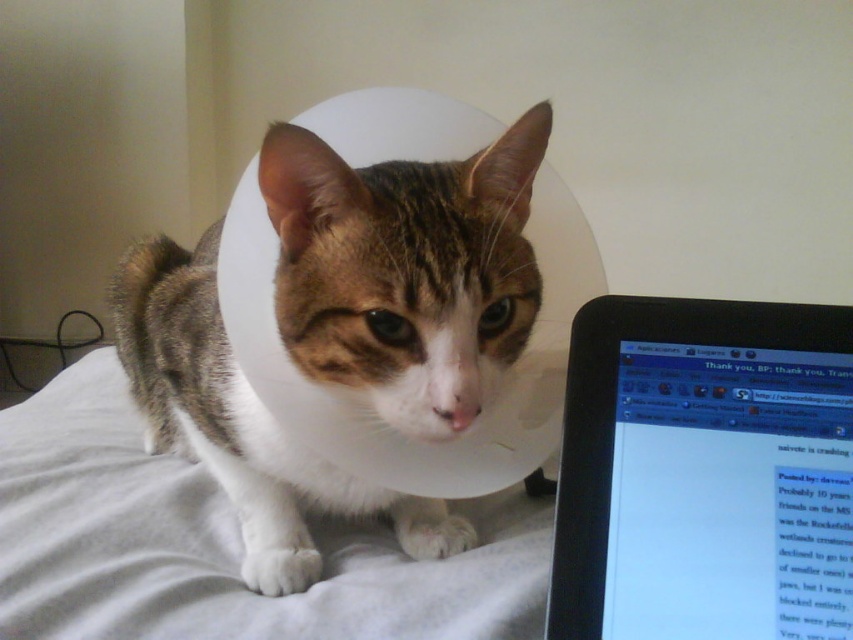
Consider the image. You are a veterinarian examining a cat with an e collar. The cat is on a light fabric surface. You see the point at coordinates (x=405, y=269). What is located at that point?

The point at coordinates (x=405, y=269) indicates the tabby fur cat at center.

You are a veterinarian checking the e collar of the tabby fur cat at center and the black glossy laptop at right. Which object is taller?

The tabby fur cat at center is taller than the black glossy laptop at right.